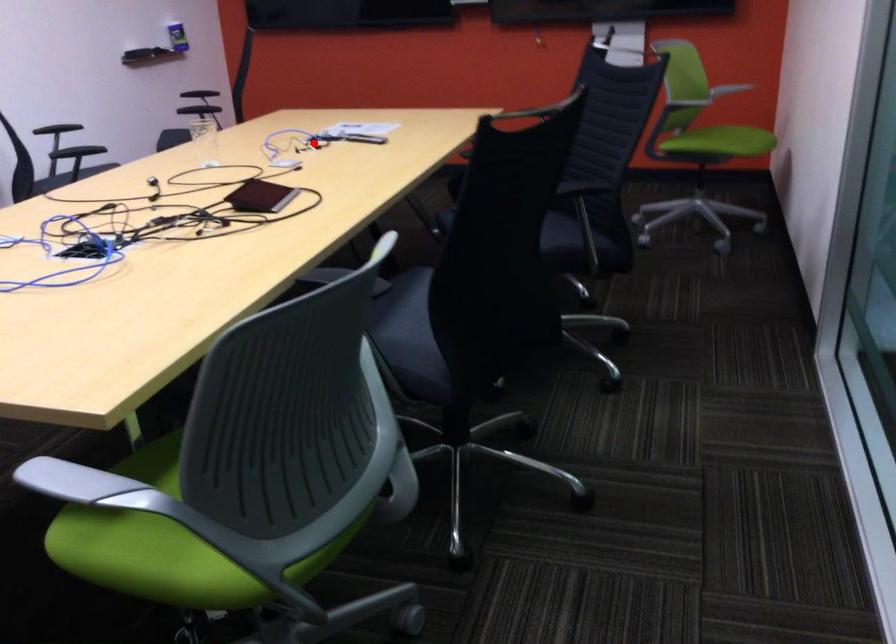
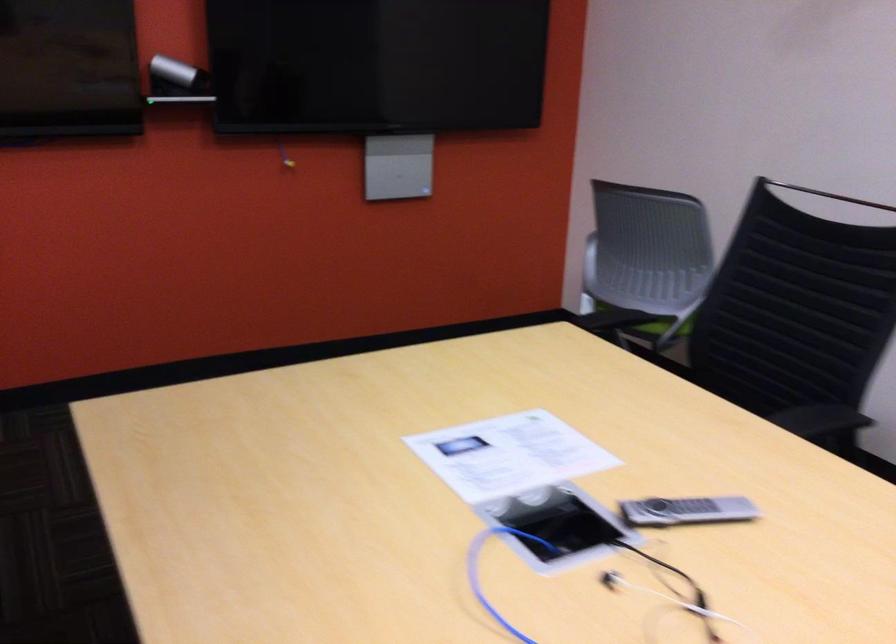
Question: I am providing you with two images of the same scene from different viewpoints. Image1 has a red point marked. In image2, the corresponding 3D location appears at what relative position? Reply with the corresponding letter.

Choices:
 (A) Closer
 (B) Farther

Answer: (A)